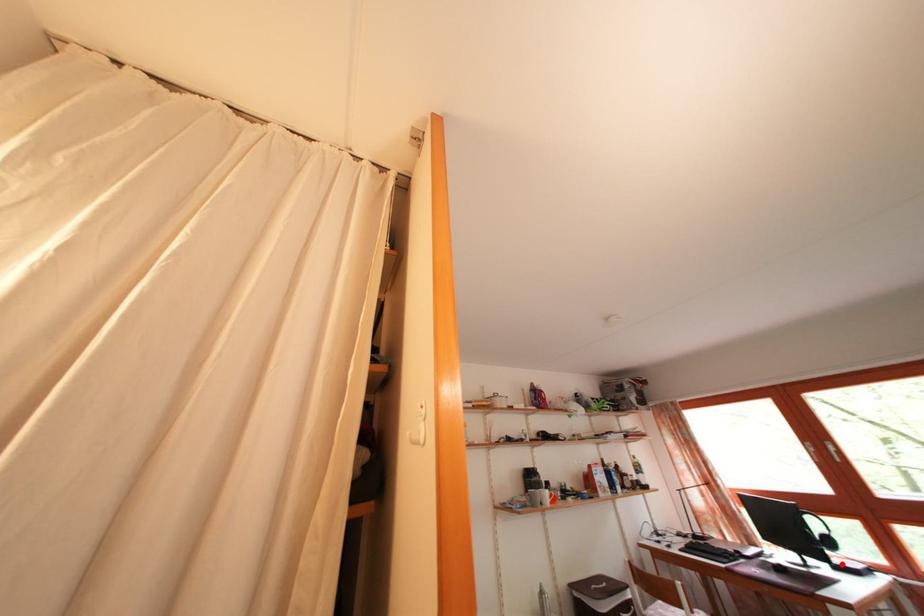
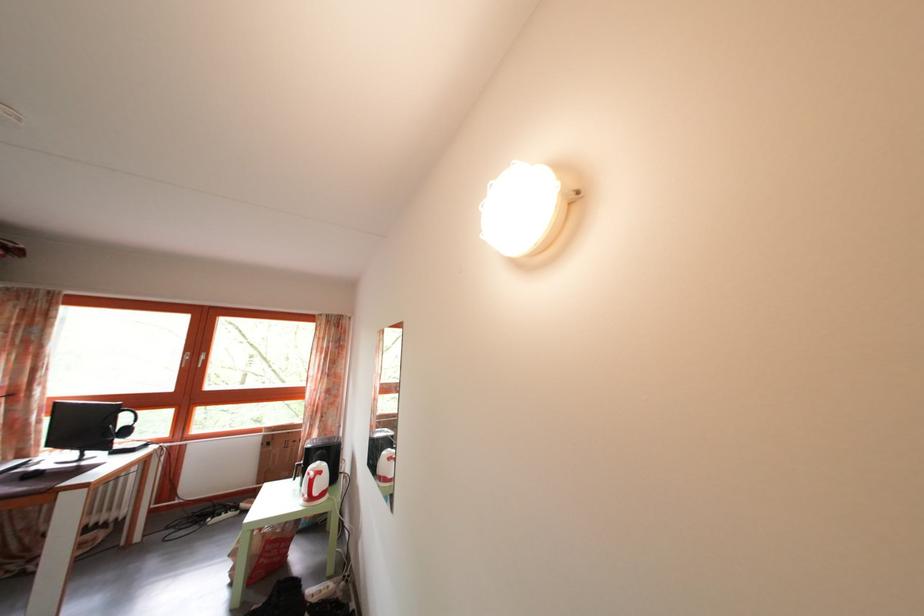
Question: I am providing you with two images of the same scene from different viewpoints. Image1 has a red point marked. In image2, the corresponding 3D location appears at what relative position? Reply with the corresponding letter.

Choices:
 (A) Closer
 (B) Farther

Answer: (B)